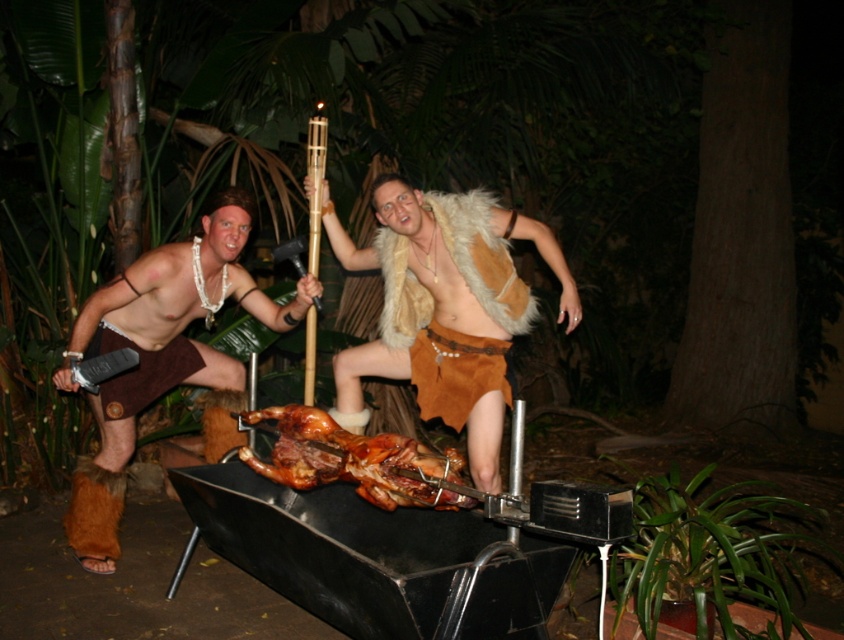
Is fur vest at center in front of golden brown roasted lamb at center?

No, fur vest at center is behind golden brown roasted lamb at center.

Between point (479, 284) and point (282, 419), which one is positioned in front?

Point (282, 419) is more forward.

Is point (395, 282) closer to viewer compared to point (422, 452)?

That is True.

What are the coordinates of `fur vest at center` in the screenshot? It's located at (434, 340).

Is brown leather shorts at left below golden brown roasted lamb at center?

No, brown leather shorts at left is not below golden brown roasted lamb at center.

Who is shorter, brown leather shorts at left or golden brown roasted lamb at center?

golden brown roasted lamb at center is shorter.

Find the location of a particular element. brown leather shorts at left is located at coordinates 161,352.

Which is more to the right, fur-covered vest at center or golden brown roasted lamb at center?

fur-covered vest at center

Which of these two, fur-covered vest at center or golden brown roasted lamb at center, stands shorter?

golden brown roasted lamb at center is shorter.

Is point (485, 284) in front of point (371, 467)?

That is False.

Locate an element on the screen. The image size is (844, 640). fur-covered vest at center is located at coordinates (437, 280).